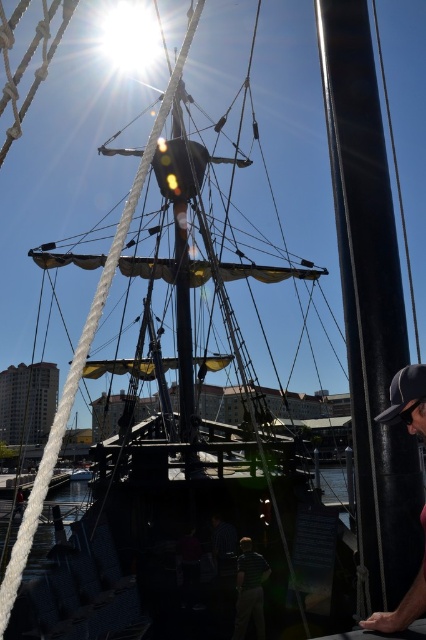
Identify the location of dark gray cap at lower right. (406, 400).

This screenshot has height=640, width=426. What do you see at coordinates (406, 400) in the screenshot? I see `dark gray cap at lower right` at bounding box center [406, 400].

Describe the element at coordinates (406, 400) in the screenshot. This screenshot has height=640, width=426. I see `dark gray cap at lower right` at that location.

The width and height of the screenshot is (426, 640). Identify the location of dark gray cap at lower right. (406, 400).

Based on the photo, does green striped shirt at center appear under black fabric baseball cap at right?

Yes, green striped shirt at center is below black fabric baseball cap at right.

Does green striped shirt at center have a lesser width compared to black fabric baseball cap at right?

No, green striped shirt at center is not thinner than black fabric baseball cap at right.

The image size is (426, 640). What do you see at coordinates (250, 589) in the screenshot?
I see `green striped shirt at center` at bounding box center [250, 589].

Where is `green striped shirt at center`? green striped shirt at center is located at coordinates (250, 589).

Who is more distant from viewer, (400,401) or (244,564)?

The point (244,564) is more distant.

Looking at this image, can you confirm if dark gray cap at lower right is bigger than green striped shirt at center?

No.

Where is `dark gray cap at lower right`? This screenshot has width=426, height=640. dark gray cap at lower right is located at coordinates (406, 400).